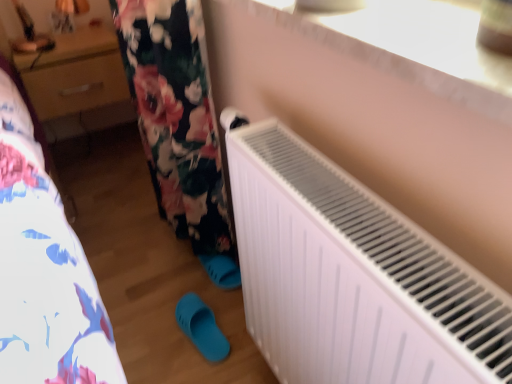
Question: From a real-world perspective, is white plastic radiator at upper right located beneath white matte radiator at lower right?

Choices:
 (A) yes
 (B) no

Answer: (B)

Question: Can you confirm if white plastic radiator at upper right is bigger than white matte radiator at lower right?

Choices:
 (A) no
 (B) yes

Answer: (A)

Question: Is white plastic radiator at upper right oriented towards white matte radiator at lower right?

Choices:
 (A) yes
 (B) no

Answer: (B)

Question: Is white plastic radiator at upper right oriented away from white matte radiator at lower right?

Choices:
 (A) no
 (B) yes

Answer: (A)

Question: Is white plastic radiator at upper right taller than white matte radiator at lower right?

Choices:
 (A) no
 (B) yes

Answer: (A)

Question: Is white plastic radiator at upper right at the right side of white matte radiator at lower right?

Choices:
 (A) yes
 (B) no

Answer: (A)

Question: Is wooden drawer at upper left completely or partially outside of white plastic radiator at upper right?

Choices:
 (A) no
 (B) yes

Answer: (B)

Question: Can you confirm if wooden drawer at upper left is smaller than white plastic radiator at upper right?

Choices:
 (A) no
 (B) yes

Answer: (A)

Question: Would you say wooden drawer at upper left contains white plastic radiator at upper right?

Choices:
 (A) yes
 (B) no

Answer: (B)

Question: From a real-world perspective, is wooden drawer at upper left under white plastic radiator at upper right?

Choices:
 (A) yes
 (B) no

Answer: (A)

Question: Is wooden drawer at upper left to the left of white plastic radiator at upper right from the viewer's perspective?

Choices:
 (A) no
 (B) yes

Answer: (B)

Question: Is wooden drawer at upper left thinner than white plastic radiator at upper right?

Choices:
 (A) yes
 (B) no

Answer: (B)

Question: Can you confirm if white matte radiator at lower right is wider than matte plastic slipper at lower center?

Choices:
 (A) yes
 (B) no

Answer: (A)